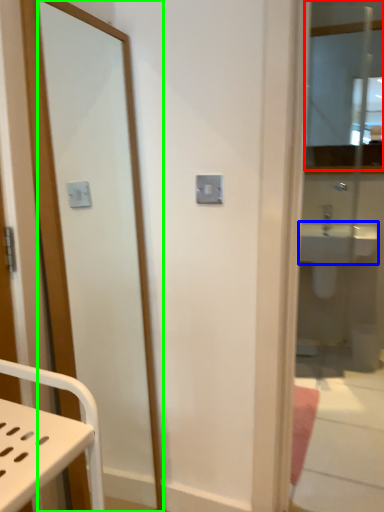
Question: Which object is positioned closest to mirror (highlighted by a red box)? Select from sink (highlighted by a blue box) and mirror (highlighted by a green box).

Choices:
 (A) sink
 (B) mirror

Answer: (A)